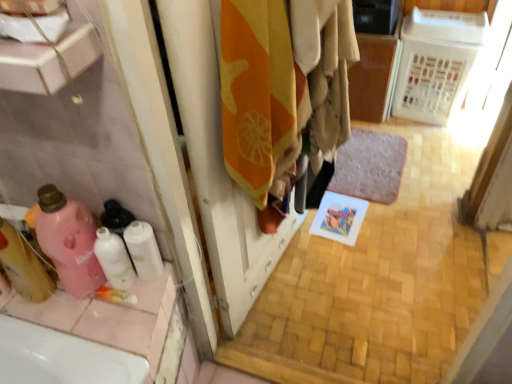
Measure the distance between point (214, 202) and camera.

The distance of point (214, 202) from camera is 3.65 feet.

Locate an element on the screen. The height and width of the screenshot is (384, 512). gray plush bath mat at center is located at coordinates (370, 166).

This screenshot has height=384, width=512. Describe the element at coordinates (69, 241) in the screenshot. I see `pink matte bottle at lower left, which is counted as the second cleaning product, starting from the right` at that location.

I want to click on white matte toilet paper at lower left, so click(x=143, y=250).

I want to click on white glossy bottles at lower left, which is the first cleaning product in right-to-left order, so click(114, 259).

This screenshot has width=512, height=384. Identify the location of orange fabric at center. 217,162.

Who is shorter, orange cotton towel at center or pink matte bottle at lower left, which is counted as the second cleaning product, starting from the right?

pink matte bottle at lower left, which is counted as the second cleaning product, starting from the right, is shorter.

Based on the photo, how different are the orientations of orange cotton towel at center and pink matte bottle at lower left, acting as the 2th cleaning product starting from the left, in degrees?

The angle between the facing direction of orange cotton towel at center and the facing direction of pink matte bottle at lower left, acting as the 2th cleaning product starting from the left, is 85.1 degrees.

Considering the sizes of orange cotton towel at center and pink matte bottle at lower left, which is counted as the second cleaning product, starting from the right, in the image, is orange cotton towel at center wider or thinner than pink matte bottle at lower left, which is counted as the second cleaning product, starting from the right,?

Considering their sizes, orange cotton towel at center looks broader than pink matte bottle at lower left, which is counted as the second cleaning product, starting from the right.

Is pink matte bottle at lower left, acting as the 2th cleaning product starting from the left, a part of orange cotton towel at center?

No, pink matte bottle at lower left, acting as the 2th cleaning product starting from the left, is not inside orange cotton towel at center.

Does point (345, 174) lie behind point (326, 159)?

Yes, point (345, 174) is behind point (326, 159).

In terms of width, does gray plush bath mat at center look wider or thinner when compared to orange cotton towel at center?

Considering their sizes, gray plush bath mat at center looks broader than orange cotton towel at center.

From the picture: Is gray plush bath mat at center surrounding orange cotton towel at center?

That's incorrect, orange cotton towel at center is not inside gray plush bath mat at center.

Which object is positioned more to the right, white glossy bottles at lower left, which is the first cleaning product in right-to-left order, or pink matte bottle at lower left, which is counted as the second cleaning product, starting from the right?

From the viewer's perspective, white glossy bottles at lower left, which is the first cleaning product in right-to-left order, appears more on the right side.

Which is in front, point (95, 251) or point (59, 197)?

The point (59, 197) is in front.

Does white glossy bottles at lower left, which ranks as the 3th cleaning product in left-to-right order, have a greater height compared to pink matte bottle at lower left, acting as the 2th cleaning product starting from the left?

No, white glossy bottles at lower left, which ranks as the 3th cleaning product in left-to-right order, is not taller than pink matte bottle at lower left, acting as the 2th cleaning product starting from the left.

From the picture: Are white plastic laundry basket at upper right and pink matte bottle at lower left, acting as the 2th cleaning product starting from the left, far apart?

Yes, white plastic laundry basket at upper right is far from pink matte bottle at lower left, acting as the 2th cleaning product starting from the left.

Is white plastic laundry basket at upper right taller than pink matte bottle at lower left, which is counted as the second cleaning product, starting from the right?

Correct, white plastic laundry basket at upper right is much taller as pink matte bottle at lower left, which is counted as the second cleaning product, starting from the right.

From a real-world perspective, is white plastic laundry basket at upper right over pink matte bottle at lower left, which is counted as the second cleaning product, starting from the right?

No.

Can pink matte bottle at lower left, acting as the 2th cleaning product starting from the left, be found inside white plastic laundry basket at upper right?

No, white plastic laundry basket at upper right does not contain pink matte bottle at lower left, acting as the 2th cleaning product starting from the left.

Does gray plush bath mat at center have a smaller size compared to white matte toilet paper at lower left?

No, gray plush bath mat at center is not smaller than white matte toilet paper at lower left.

Is white matte toilet paper at lower left completely or partially inside gray plush bath mat at center?

No, white matte toilet paper at lower left is not surrounded by gray plush bath mat at center.

From the image's perspective, which is below, gray plush bath mat at center or white matte toilet paper at lower left?

white matte toilet paper at lower left appears lower in the image.

Identify the location of toilet paper located on the left of gray plush bath mat at center. This screenshot has height=384, width=512. (143, 250).

Relative to orange cotton towel at center, is white glossy bottles at lower left, which is the first cleaning product in right-to-left order, in front or behind?

Clearly, white glossy bottles at lower left, which is the first cleaning product in right-to-left order, is behind orange cotton towel at center.

Are white glossy bottles at lower left, which ranks as the 3th cleaning product in left-to-right order, and orange cotton towel at center making contact?

white glossy bottles at lower left, which ranks as the 3th cleaning product in left-to-right order, and orange cotton towel at center are not in contact.

From the image's perspective, which one is positioned higher, white glossy bottles at lower left, which ranks as the 3th cleaning product in left-to-right order, or orange cotton towel at center?

From the image's view, orange cotton towel at center is above.

Is white glossy bottles at lower left, which is the first cleaning product in right-to-left order, facing away from orange cotton towel at center?

That's not correct — white glossy bottles at lower left, which is the first cleaning product in right-to-left order, is not looking away from orange cotton towel at center.

Based on their sizes in the image, would you say white plastic laundry basket at upper right is bigger or smaller than orange fabric at center?

Considering their sizes, white plastic laundry basket at upper right takes up more space than orange fabric at center.

Between point (447, 43) and point (215, 181), which one is positioned behind?

The point (447, 43) is more distant.

From the image's perspective, which is above, white plastic laundry basket at upper right or orange fabric at center?

white plastic laundry basket at upper right is shown above in the image.

Which of these two, white plastic laundry basket at upper right or orange fabric at center, is thinner?

orange fabric at center is thinner.

This screenshot has height=384, width=512. What are the coordinates of `laundry located in front of the pink matte bottle at lower left, which is counted as the second cleaning product, starting from the right` in the screenshot? It's located at (283, 86).

Where is `laundry located above the gray plush bath mat at center (from the image's perspective)`? laundry located above the gray plush bath mat at center (from the image's perspective) is located at coordinates (283, 86).

Which object lies further to the anchor point white matte toilet paper at lower left, orange cotton towel at center or white glossy bottles at lower left, which ranks as the 3th cleaning product in left-to-right order?

Among the two, orange cotton towel at center is located further to white matte toilet paper at lower left.

Looking at the image, which one is located closer to white glossy bottles at lower left, which is the first cleaning product in right-to-left order, orange cotton towel at center or white plastic laundry basket at upper right?

The object closer to white glossy bottles at lower left, which is the first cleaning product in right-to-left order, is orange cotton towel at center.

From the image, which object appears to be farther from orange fabric at center, orange cotton towel at center or pink matte bottle at lower left, which is counted as the second cleaning product, starting from the right?

pink matte bottle at lower left, which is counted as the second cleaning product, starting from the right, is further to orange fabric at center.

From the image, which object appears to be farther from gray plush bath mat at center, orange cotton towel at center or pink matte bottle at lower left, which is counted as the second cleaning product, starting from the right?

pink matte bottle at lower left, which is counted as the second cleaning product, starting from the right, lies further to gray plush bath mat at center than the other object.

Considering their positions, is pink matte bottle at lower left, acting as the 2th cleaning product starting from the left, positioned closer to orange fabric at center than gray plush bath mat at center?

Among the two, pink matte bottle at lower left, acting as the 2th cleaning product starting from the left, is located nearer to orange fabric at center.

Looking at the image, which one is located closer to gray plush bath mat at center, white glossy bottles at lower left, which ranks as the 3th cleaning product in left-to-right order, or white matte toilet paper at lower left?

white matte toilet paper at lower left is closer to gray plush bath mat at center.

Based on their spatial positions, is orange cotton towel at center or translucent pink bottle at left, which ranks as the third cleaning product in right-to-left order, closer to white plastic laundry basket at upper right?

orange cotton towel at center is closer to white plastic laundry basket at upper right.

Considering their positions, is white plastic laundry basket at upper right positioned further to pink matte bottle at lower left, which is counted as the second cleaning product, starting from the right, than orange cotton towel at center?

Based on the image, white plastic laundry basket at upper right appears to be further to pink matte bottle at lower left, which is counted as the second cleaning product, starting from the right.

Locate an element on the screen. The height and width of the screenshot is (384, 512). toilet paper situated between white glossy bottles at lower left, which is the first cleaning product in right-to-left order, and orange fabric at center from left to right is located at coordinates (143, 250).

Find the location of a particular element. This screenshot has width=512, height=384. bath mat between pink matte bottle at lower left, acting as the 2th cleaning product starting from the left, and white plastic laundry basket at upper right is located at coordinates (370, 166).

Find the location of a particular element. toilet paper between pink matte bottle at lower left, acting as the 2th cleaning product starting from the left, and orange cotton towel at center from left to right is located at coordinates (143, 250).

You are a GUI agent. You are given a task and a screenshot of the screen. Output one action in this format:
    pyautogui.click(x=<x>, y=<y>)
    Task: Click on the cleaning product situated between pink matte bottle at lower left, which is counted as the second cleaning product, starting from the right, and orange cotton towel at center from left to right
    
    Given the screenshot: What is the action you would take?
    pyautogui.click(x=114, y=259)